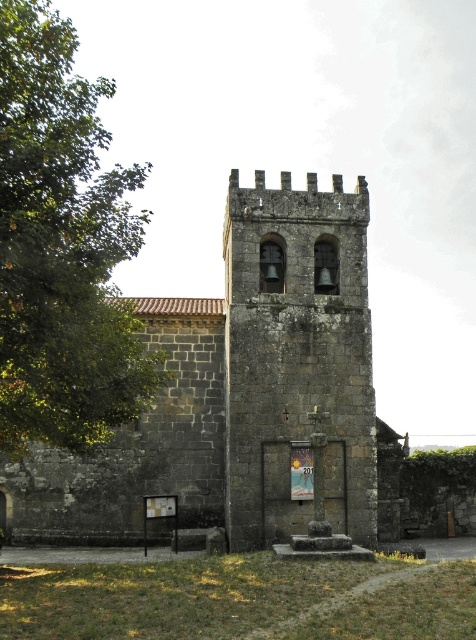
Question: Which object is positioned farthest from the green leafy tree at left?

Choices:
 (A) stone bell tower at center
 (B) dark gray stone church at center

Answer: (A)

Question: Is dark gray stone church at center closer to the viewer compared to stone bell tower at center?

Choices:
 (A) no
 (B) yes

Answer: (A)

Question: From the image, what is the correct spatial relationship of dark gray stone church at center in relation to stone bell tower at center?

Choices:
 (A) left
 (B) right

Answer: (A)

Question: Estimate the real-world distances between objects in this image. Which object is farther from the green leafy tree at left?

Choices:
 (A) stone bell tower at center
 (B) dark gray stone church at center

Answer: (A)

Question: Is green leafy tree at left positioned before stone bell tower at center?

Choices:
 (A) yes
 (B) no

Answer: (A)

Question: Which object is the farthest from the dark gray stone church at center?

Choices:
 (A) stone bell tower at center
 (B) green leafy tree at left

Answer: (B)